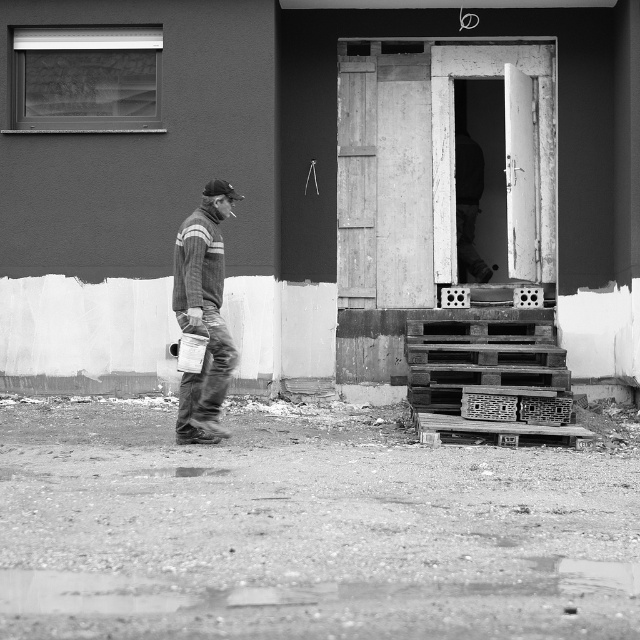
You are a construction worker who needs to move the striped fleece jacket at left to the other side of the wooden pallets at lower right. Considering the space between them, will the jacket fit through without needing to be folded?

The wooden pallets at lower right are wider than the striped fleece jacket at left, so the jacket can fit through the space between them without needing to be folded.